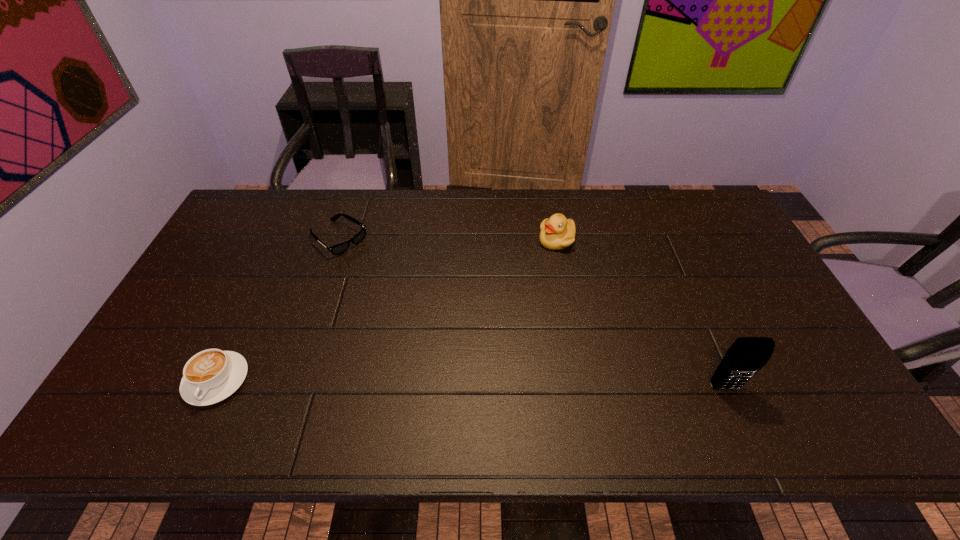
At what (x,y) coordinates should I click in order to perform the action: click on blank space at the far edge of the desktop. Please return your answer as a coordinate pair (x, y). Looking at the image, I should click on (387, 191).

Where is `free space at the right edge of the desktop`? The height and width of the screenshot is (540, 960). free space at the right edge of the desktop is located at coordinates (736, 284).

Identify the location of free space at the near right corner of the desktop. This screenshot has width=960, height=540. (833, 387).

Identify the location of unoccupied area between the second shortest object and the second object from right to left. 387,310.

Locate an element on the screen. Image resolution: width=960 pixels, height=540 pixels. blank region between the duckling and the second object from left to right is located at coordinates (447, 239).

At what (x,y) coordinates should I click in order to perform the action: click on vacant area that lies between the second tallest object and the rightmost object. Please return your answer as a coordinate pair (x, y). Looking at the image, I should click on (641, 314).

Locate an element on the screen. The image size is (960, 540). vacant area that lies between the second object from left to right and the tallest object is located at coordinates (532, 313).

Locate an element on the screen. free space between the cappuccino and the shortest object is located at coordinates (277, 309).

Identify the location of vacant point located between the cappuccino and the third object from left to right. The image size is (960, 540). (387, 310).

This screenshot has height=540, width=960. I want to click on vacant space in between the cellular telephone and the shortest object, so click(x=532, y=313).